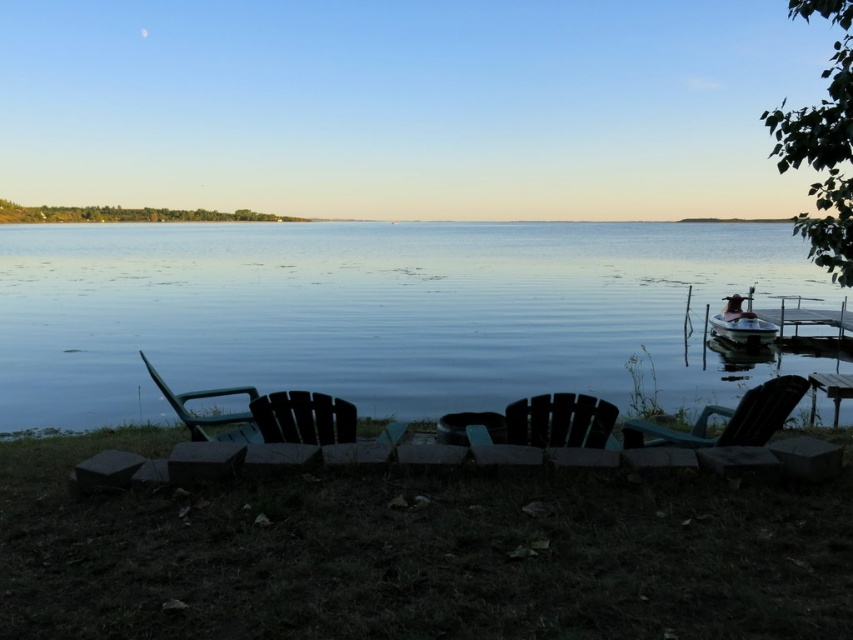
Which is in front, point (76, 376) or point (654, 428)?

Point (654, 428) is in front.

Which is more to the left, blue water at center or teal plastic chair at right?

teal plastic chair at right

The height and width of the screenshot is (640, 853). Describe the element at coordinates (372, 312) in the screenshot. I see `blue water at center` at that location.

This screenshot has width=853, height=640. I want to click on blue water at center, so click(372, 312).

This screenshot has width=853, height=640. What are the coordinates of `black wood chair at center` in the screenshot? It's located at (303, 417).

Is point (335, 438) closer to viewer compared to point (798, 296)?

Yes, it is.

Is point (262, 412) behind point (811, 344)?

No, it is not.

This screenshot has width=853, height=640. Find the location of `black wood chair at center`. black wood chair at center is located at coordinates (303, 417).

Between dark wood chair at center and wooden dock at right, which one has more height?

Standing taller between the two is wooden dock at right.

Between dark wood chair at center and wooden dock at right, which one is positioned higher?

wooden dock at right is above.

Which is in front, point (610, 404) or point (804, 339)?

Positioned in front is point (610, 404).

Identify the location of dark wood chair at center. This screenshot has height=640, width=853. (537, 422).